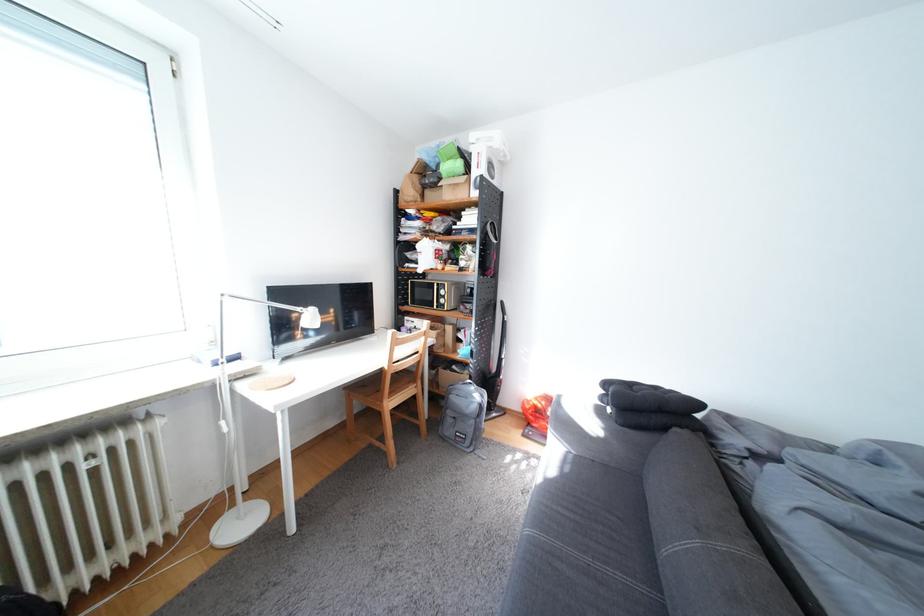
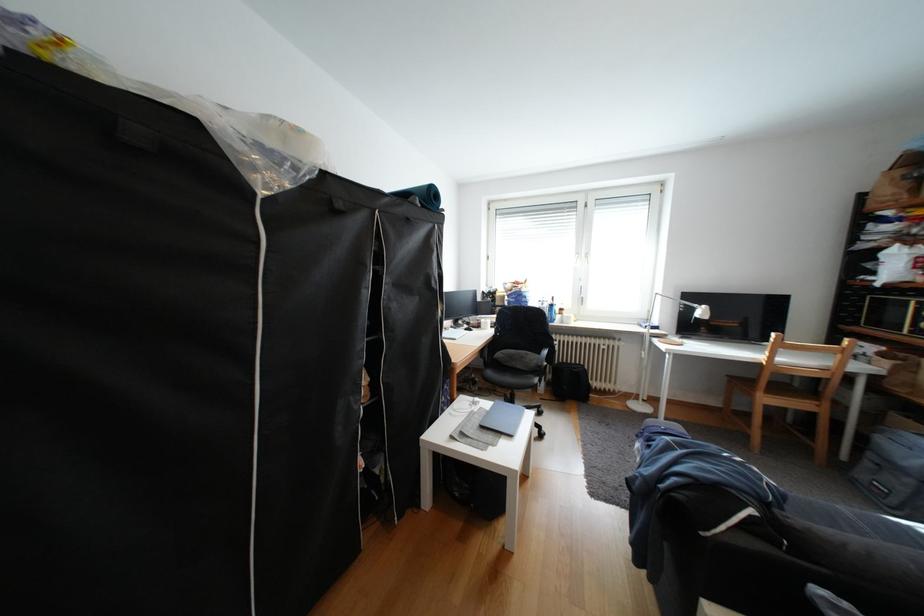
Question: I am providing you with two images of the same scene from different viewpoints. After the viewpoint changes to image2, which objects are now occluded?

Choices:
 (A) white lamp head
 (B) black chair armrest
 (C) black backpack
 (D) none of these

Answer: (D)